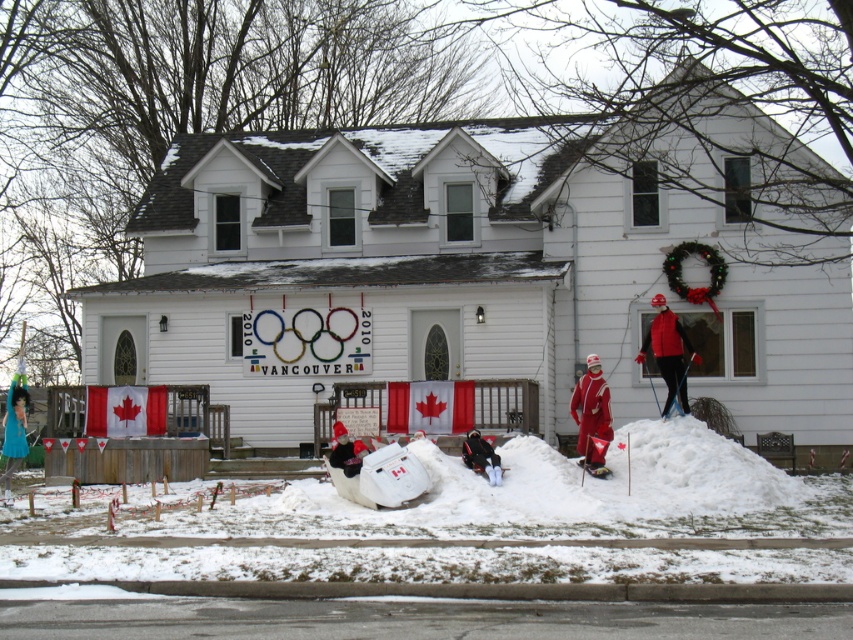
Question: Does white fluffy snow at lower center appear over teal fabric dress at lower left?

Choices:
 (A) yes
 (B) no

Answer: (B)

Question: Based on their relative distances, which object is nearer to the white fluffy snow at lower center?

Choices:
 (A) matte red ski suit at center
 (B) white plastic sled at lower center
 (C) teal fabric dress at lower left
 (D) red matte ski suit at right

Answer: (B)

Question: Which point is farther from the camera taking this photo?

Choices:
 (A) (585, 371)
 (B) (660, 342)
 (C) (4, 449)
 (D) (152, 560)

Answer: (A)

Question: Which object is positioned closest to the teal fabric dress at lower left?

Choices:
 (A) matte red ski suit at center
 (B) white fluffy snow at lower center
 (C) white plastic sled at lower center
 (D) red matte ski suit at right

Answer: (C)

Question: Can you confirm if matte red ski suit at center is positioned below teal fabric dress at lower left?

Choices:
 (A) no
 (B) yes

Answer: (A)

Question: In this image, where is red matte ski suit at right located relative to teal fabric dress at lower left?

Choices:
 (A) right
 (B) left

Answer: (A)